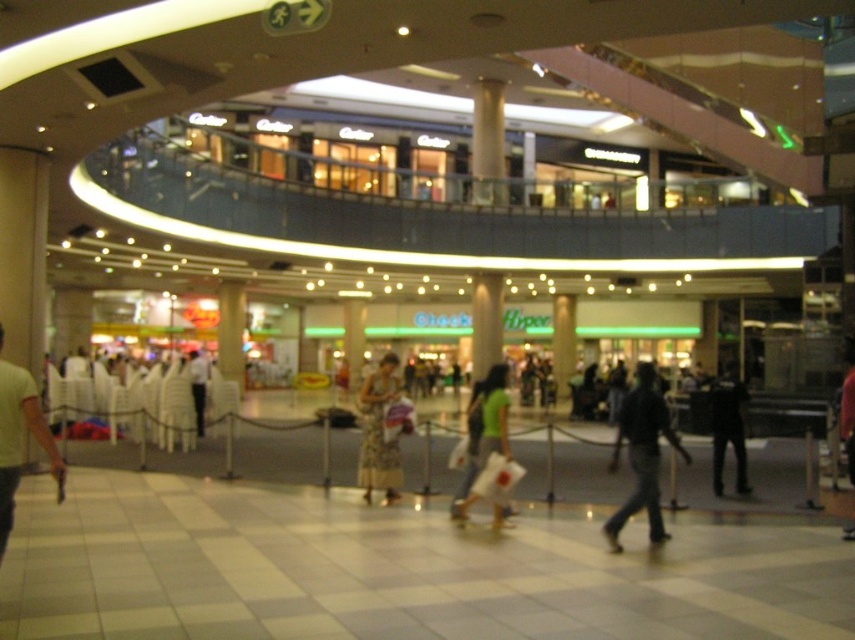
Is green cotton shirt at center positioned before black matte pants at lower right?

That is True.

Between green cotton shirt at center and black matte pants at lower right, which one appears on the right side from the viewer's perspective?

black matte pants at lower right

Locate an element on the screen. This screenshot has width=855, height=640. green cotton shirt at center is located at coordinates (488, 417).

Between point (34, 392) and point (475, 460), which one is positioned in front?

Point (34, 392) is in front.

Is point (16, 474) behind point (482, 410)?

That is False.

At what (x,y) coordinates should I click in order to perform the action: click on green matte shirt at center. Please return your answer as a coordinate pair (x, y). The height and width of the screenshot is (640, 855). Looking at the image, I should click on (21, 440).

Who is taller, dark blue jeans at center or green matte shirt at center?

Standing taller between the two is dark blue jeans at center.

Does dark blue jeans at center come behind green matte shirt at center?

That is True.

Is point (646, 412) in front of point (54, 465)?

No, (646, 412) is further to viewer.

Identify the location of dark blue jeans at center. (641, 454).